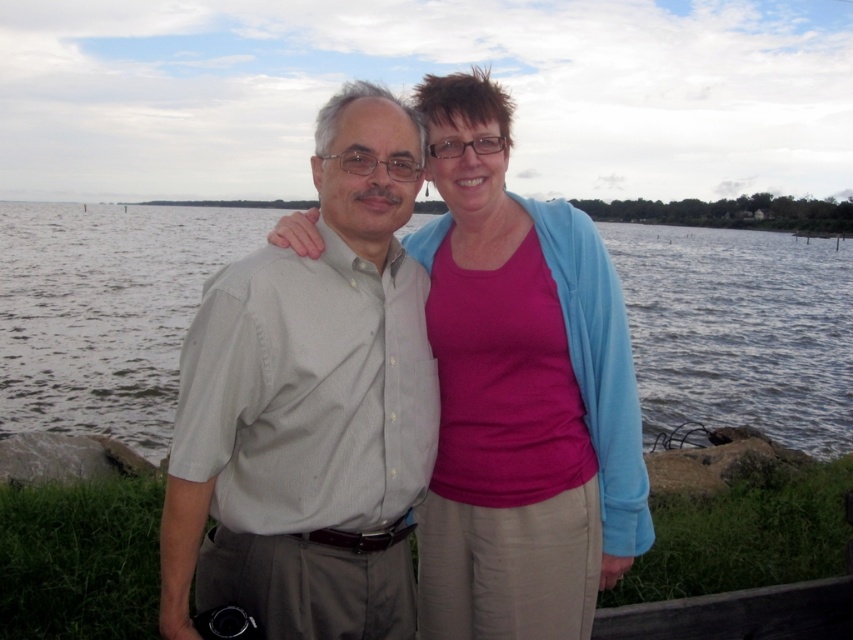
Question: In this image, where is light gray shirt at center located relative to clear water at center?

Choices:
 (A) left
 (B) right

Answer: (B)

Question: Estimate the real-world distances between objects in this image. Which object is farther from the clear water at center?

Choices:
 (A) light gray shirt at center
 (B) pink matte shirt at center

Answer: (B)

Question: Is pink matte shirt at center further to camera compared to clear water at center?

Choices:
 (A) no
 (B) yes

Answer: (A)

Question: Which point is closer to the camera?

Choices:
 (A) light gray shirt at center
 (B) pink matte shirt at center
 (C) clear water at center

Answer: (A)

Question: Does pink matte shirt at center have a smaller size compared to clear water at center?

Choices:
 (A) yes
 (B) no

Answer: (A)

Question: Which object is the farthest from the light gray shirt at center?

Choices:
 (A) pink matte shirt at center
 (B) clear water at center

Answer: (B)